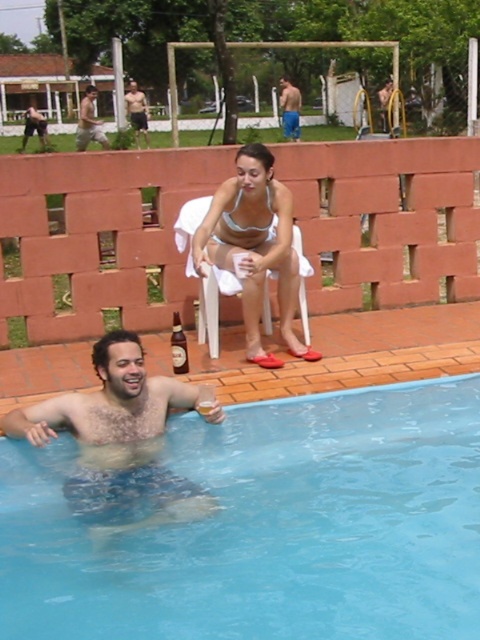
Question: Considering the relative positions of light brown wood chair at upper center and brown glass bottle at lower left in the image provided, where is light brown wood chair at upper center located with respect to brown glass bottle at lower left?

Choices:
 (A) above
 (B) below

Answer: (A)

Question: Is blue smooth water at lower left positioned at the back of shiny blue shorts at lower left?

Choices:
 (A) no
 (B) yes

Answer: (A)

Question: Is light brown wood chair at upper center to the right of blue denim shorts at upper center from the viewer's perspective?

Choices:
 (A) yes
 (B) no

Answer: (B)

Question: Based on their relative distances, which object is nearer to the shiny metallic shorts at center?

Choices:
 (A) light brown wood chair at upper center
 (B) white mesh bikini top at upper center

Answer: (A)

Question: Which of the following is the farthest from the observer?

Choices:
 (A) (231, 225)
 (B) (82, 106)
 (C) (94, 484)
 (D) (172, 326)

Answer: (B)

Question: Which point is closer to the camera?

Choices:
 (A) (210, 406)
 (B) (382, 404)
 (C) (228, 204)

Answer: (A)